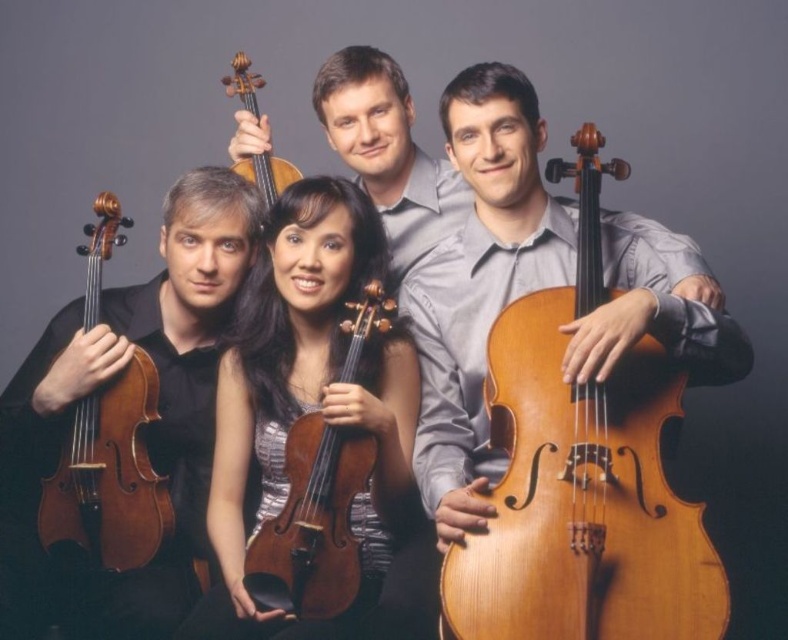
You are a photographer setting up for a group photo. You need to ensure that the wooden violin at center and the matte gray shirt at upper center are both visible in the frame. Based on their sizes, which object might require more careful positioning to avoid being obscured?

The wooden violin at center is thinner than the matte gray shirt at upper center, so it might require more careful positioning to avoid being obscured because its smaller size could make it harder to see clearly in the frame.

You are a photographer adjusting your camera settings to focus on the wooden violin at center and the matte gray shirt at upper center. Which object should you focus on first to ensure both are in sharp focus?

The wooden violin at center is closer to the viewer than the matte gray shirt at upper center, so you should focus on the wooden violin at center first to ensure both are in sharp focus.

In the studio image with four people holding stringed instruments, where exactly is the matte black violin at left located in terms of coordinates?

The matte black violin at left is located at coordinates point (147, 428).